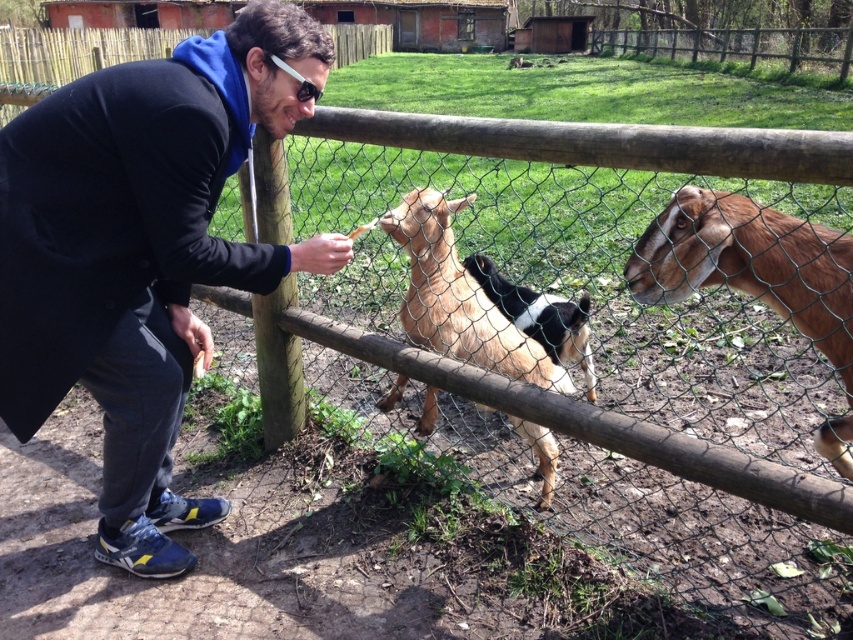
Is brown furry goat at center smaller than black and white fur goat at center?

No.

The height and width of the screenshot is (640, 853). What do you see at coordinates (457, 298) in the screenshot?
I see `brown furry goat at center` at bounding box center [457, 298].

Which is in front, point (444, 312) or point (563, 339)?

Point (444, 312) is more forward.

Where is `brown furry goat at center`? brown furry goat at center is located at coordinates (457, 298).

Between black fabric jacket at left and black and white fur goat at center, which one has less height?

black and white fur goat at center

Which is above, black fabric jacket at left or black and white fur goat at center?

black and white fur goat at center is above.

The image size is (853, 640). In order to click on black fabric jacket at left in this screenshot , I will do `click(141, 252)`.

Is point (728, 284) closer to viewer compared to point (294, 70)?

Yes, it is in front of point (294, 70).

Who is taller, brown matte goat at center or sunglasses at center?

brown matte goat at center is taller.

Is point (820, 275) behind point (312, 92)?

No, it is in front of (312, 92).

What are the coordinates of `brown matte goat at center` in the screenshot? It's located at (750, 264).